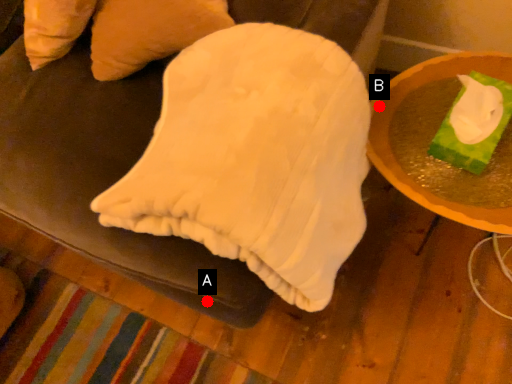
Question: Two points are circled on the image, labeled by A and B beside each circle. Which of the following is the closest to the observer?

Choices:
 (A) A is closer
 (B) B is closer

Answer: (A)